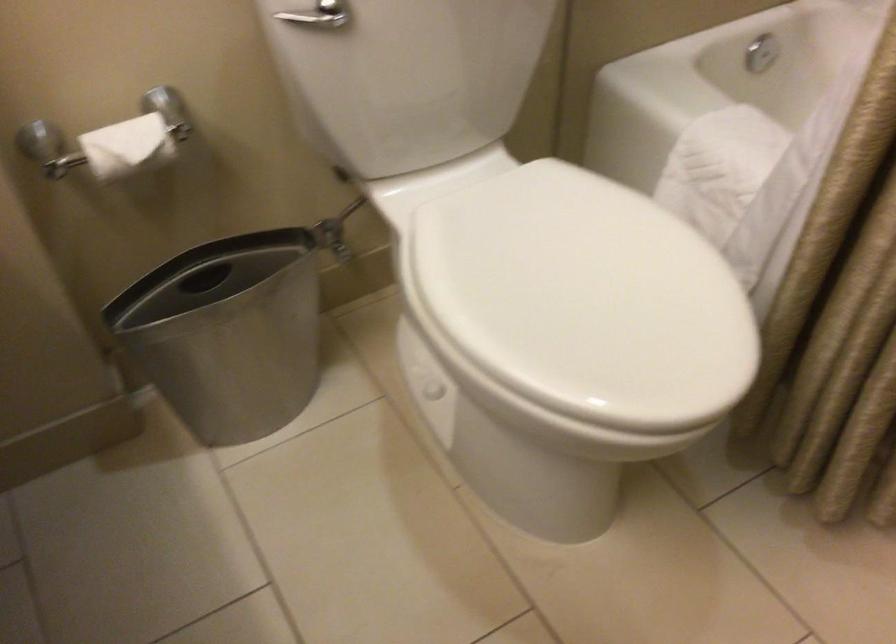
What do you see at coordinates (104, 152) in the screenshot? This screenshot has height=644, width=896. I see `a bathtub grab bar` at bounding box center [104, 152].